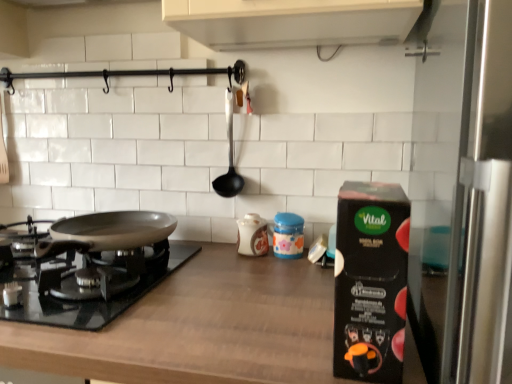
Identify the location of free spot above brown wood countertop at center (from a real-world perspective). (198, 283).